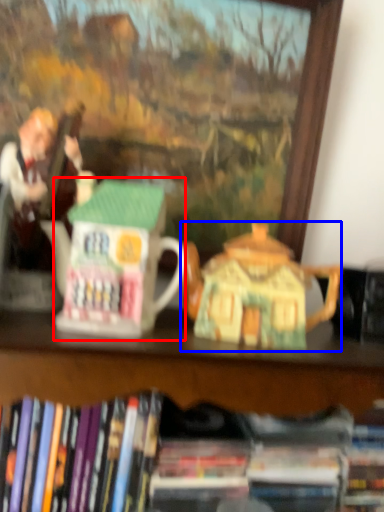
Question: Which object appears farthest to the camera in this image, toy (highlighted by a red box) or teapot (highlighted by a blue box)?

Choices:
 (A) toy
 (B) teapot

Answer: (B)